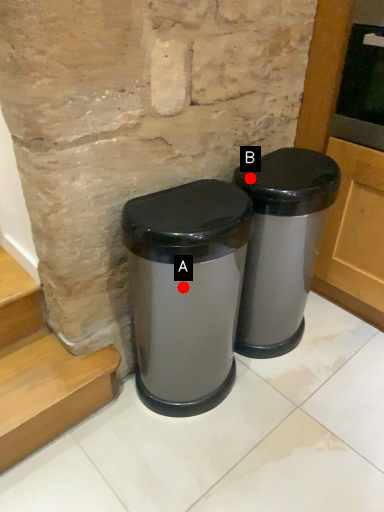
Question: Two points are circled on the image, labeled by A and B beside each circle. Which point is closer to the camera?

Choices:
 (A) A is closer
 (B) B is closer

Answer: (A)